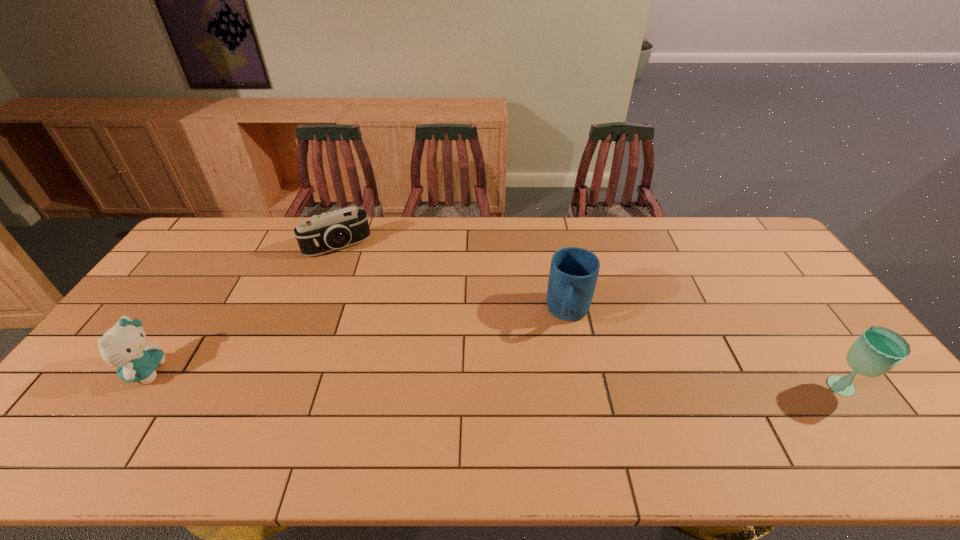
Where is `free space between the second object from left to right and the rightmost object`? The image size is (960, 540). free space between the second object from left to right and the rightmost object is located at coordinates 590,318.

Locate an element on the screen. vacant space that is in between the leftmost object and the glass is located at coordinates (494, 380).

Identify the location of vacant point located between the rightmost object and the kitten. (494, 380).

I want to click on free space between the leftmost object and the rightmost object, so click(x=494, y=380).

Where is `vacant region between the third nearest object and the leftmost object`? vacant region between the third nearest object and the leftmost object is located at coordinates (357, 342).

This screenshot has height=540, width=960. I want to click on vacant region between the third object from right to left and the second object from right to left, so click(x=453, y=280).

Where is `object that is the nearest to the farthest object`? The image size is (960, 540). object that is the nearest to the farthest object is located at coordinates 123,346.

Locate which object ranks third in proximity to the farthest object. Please provide its 2D coordinates. Your answer should be formatted as a tuple, i.e. [(x, y)], where the tuple contains the x and y coordinates of a point satisfying the conditions above.

[(878, 350)]

At what (x,y) coordinates should I click in order to perform the action: click on free spot that satisfies the following two spatial constraints: 1. on the front side of the farthest object; 2. on the left side of the third object from left to right. Please return your answer as a coordinate pair (x, y). Looking at the image, I should click on (311, 314).